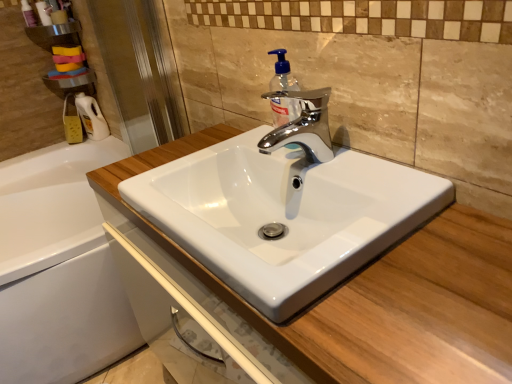
Identify the location of white plastic bottle at left. Image resolution: width=512 pixels, height=384 pixels. (91, 117).

Image resolution: width=512 pixels, height=384 pixels. What are the coordinates of `white glossy bathtub at lower left` in the screenshot? It's located at (59, 268).

Describe the element at coordinates (140, 70) in the screenshot. The height and width of the screenshot is (384, 512). I see `transparent plastic screen door at left` at that location.

Find the location of a particular element. white glossy sink at center is located at coordinates (285, 208).

Based on the photo, measure the distance between point (298, 89) and camera.

90.00 centimeters.

Locate an element on the screen. This screenshot has width=512, height=384. white plastic bottle at left is located at coordinates (91, 117).

From the image's perspective, is white glossy bathtub at lower left located above or below transparent plastic soap dispenser at center?

Clearly, from the image's perspective, white glossy bathtub at lower left is below transparent plastic soap dispenser at center.

Who is smaller, white glossy bathtub at lower left or transparent plastic soap dispenser at center?

With smaller size is transparent plastic soap dispenser at center.

I want to click on soap dispenser above the transparent plastic screen door at left (from a real-world perspective), so click(x=282, y=74).

Could you measure the distance between transparent plastic soap dispenser at center and transparent plastic screen door at left?

transparent plastic soap dispenser at center is 28.61 inches away from transparent plastic screen door at left.

In the scene shown: From the image's perspective, is transparent plastic soap dispenser at center located beneath transparent plastic screen door at left?

Yes.

Is the surface of metallic silver shelf at upper left in direct contact with white plastic bottle at left?

No.

Is metallic silver shelf at upper left behind white plastic bottle at left?

No, it is in front of white plastic bottle at left.

Considering the relative positions of metallic silver shelf at upper left and white plastic bottle at left in the image provided, is metallic silver shelf at upper left to the left or to the right of white plastic bottle at left?

Based on their positions, metallic silver shelf at upper left is located to the left of white plastic bottle at left.

Is metallic silver shelf at upper left taller than white plastic bottle at left?

Yes.

From the image's perspective, between matte white lotion at upper left and white glossy sink at center, who is located below?

From the image's view, white glossy sink at center is below.

Is matte white lotion at upper left to the left or to the right of white glossy sink at center in the image?

Based on their positions, matte white lotion at upper left is located to the left of white glossy sink at center.

Is white glossy sink at center surrounded by matte white lotion at upper left?

No, white glossy sink at center is not surrounded by matte white lotion at upper left.

Considering the positions of objects matte white lotion at upper left and transparent plastic soap dispenser at center in the image provided, who is more to the left, matte white lotion at upper left or transparent plastic soap dispenser at center?

matte white lotion at upper left is more to the left.

Can you tell me how much matte white lotion at upper left and transparent plastic soap dispenser at center differ in facing direction?

There is a 91.1-degree angle between the facing directions of matte white lotion at upper left and transparent plastic soap dispenser at center.

Is point (49, 22) closer or farther from the camera than point (275, 111)?

Point (49, 22) is positioned farther from the camera compared to point (275, 111).

Is matte white lotion at upper left far away from transparent plastic soap dispenser at center?

Yes.

Could you tell me if transparent plastic soap dispenser at center is turned towards white plastic bottle at left?

No, transparent plastic soap dispenser at center is not facing towards white plastic bottle at left.

Which is farther, (282, 77) or (100, 113)?

The point (100, 113) is farther.

From the image's perspective, between transparent plastic soap dispenser at center and white plastic bottle at left, which one is located above?

From the image's view, white plastic bottle at left is above.

From a real-world perspective, does transparent plastic soap dispenser at center stand above white plastic bottle at left?

Indeed, from a real-world perspective, transparent plastic soap dispenser at center stands above white plastic bottle at left.

From the image's perspective, which one is positioned lower, white glossy sink at center or transparent plastic screen door at left?

white glossy sink at center is shown below in the image.

Considering the sizes of objects white glossy sink at center and transparent plastic screen door at left in the image provided, who is shorter, white glossy sink at center or transparent plastic screen door at left?

white glossy sink at center is shorter.

Which of these two, white glossy sink at center or transparent plastic screen door at left, is smaller?

Smaller between the two is white glossy sink at center.

Locate an element on the screen. Image resolution: width=512 pixels, height=384 pixels. bath on the left of transparent plastic soap dispenser at center is located at coordinates (59, 268).

What are the coordinates of `screen door below the transparent plastic soap dispenser at center (from a real-world perspective)` in the screenshot? It's located at (140, 70).

Based on their spatial positions, is metallic silver shelf at upper left or transparent plastic soap dispenser at center further from white plastic bottle at left?

transparent plastic soap dispenser at center lies further to white plastic bottle at left than the other object.

Considering their positions, is white plastic bottle at left positioned further to metallic silver shelf at upper left than transparent plastic soap dispenser at center?

The object further to metallic silver shelf at upper left is transparent plastic soap dispenser at center.

Based on their spatial positions, is white glossy bathtub at lower left or white glossy sink at center further from transparent plastic soap dispenser at center?

white glossy bathtub at lower left is positioned further to the anchor transparent plastic soap dispenser at center.

When comparing their distances from matte white lotion at upper left, does white plastic bottle at left or white glossy bathtub at lower left seem closer?

The object closer to matte white lotion at upper left is white plastic bottle at left.

Estimate the real-world distances between objects in this image. Which object is closer to transparent plastic soap dispenser at center, matte white lotion at upper left or metallic silver shelf at upper left?

metallic silver shelf at upper left lies closer to transparent plastic soap dispenser at center than the other object.

Based on their spatial positions, is transparent plastic soap dispenser at center or white glossy sink at center further from white plastic bottle at left?

Based on the image, white glossy sink at center appears to be further to white plastic bottle at left.

Based on their spatial positions, is transparent plastic screen door at left or white glossy sink at center closer to metallic silver shelf at upper left?

transparent plastic screen door at left is positioned closer to the anchor metallic silver shelf at upper left.

Which object lies nearer to the anchor point transparent plastic soap dispenser at center, matte white lotion at upper left or white glossy bathtub at lower left?

white glossy bathtub at lower left.

This screenshot has height=384, width=512. Find the location of `soap dispenser between white glossy sink at center and matte white lotion at upper left from front to back`. soap dispenser between white glossy sink at center and matte white lotion at upper left from front to back is located at coordinates (282, 74).

Where is `shelf positioned between white glossy sink at center and matte white lotion at upper left from near to far`? This screenshot has height=384, width=512. shelf positioned between white glossy sink at center and matte white lotion at upper left from near to far is located at coordinates (64, 55).

Where is `screen door between metallic silver shelf at upper left and white glossy bathtub at lower left in the up-down direction`? screen door between metallic silver shelf at upper left and white glossy bathtub at lower left in the up-down direction is located at coordinates (140, 70).

Where is `screen door between matte white lotion at upper left and white glossy bathtub at lower left in the up-down direction`? screen door between matte white lotion at upper left and white glossy bathtub at lower left in the up-down direction is located at coordinates (140, 70).